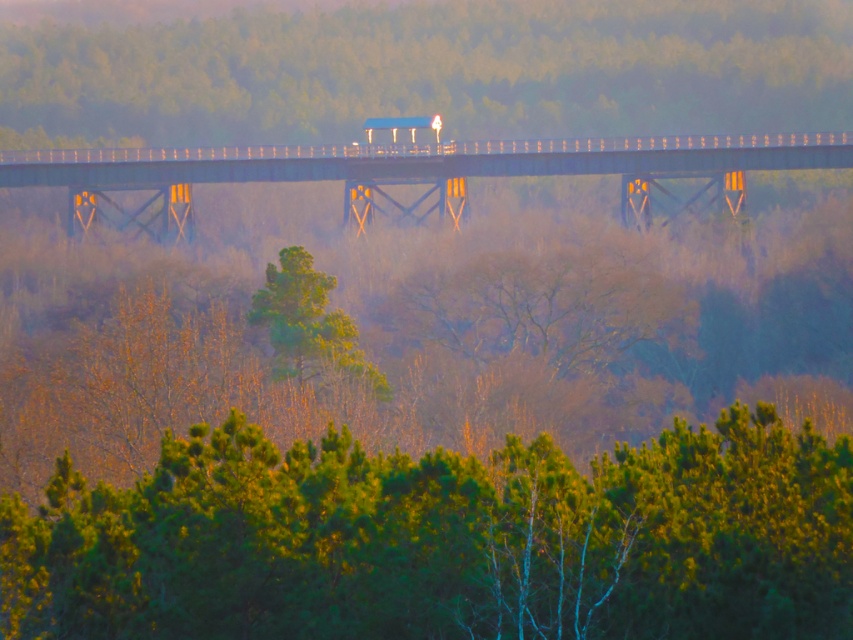
You are a driver approaching the bridge and notice both the foggy haze at upper center and the green matte tree at center in your view. Which object appears wider from your perspective?

The foggy haze at upper center appears wider than the green matte tree at center because its width surpasses the tree.

You are standing at point (x=115, y=156) on the bridge and want to walk towards point (x=231, y=16). Which direction should you face to move towards your destination?

You should face towards the direction opposite of the bridge span because point (x=231, y=16) is behind point (x=115, y=156).